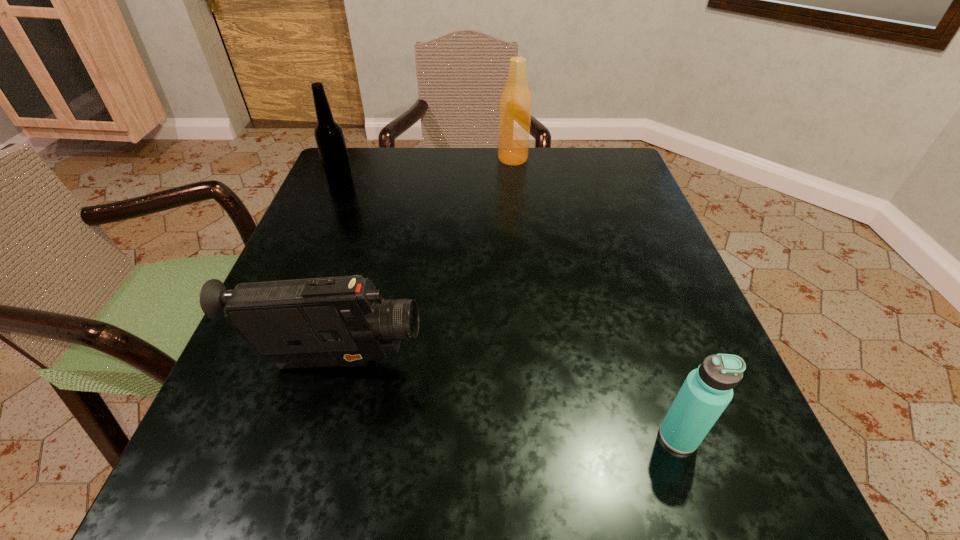
Identify the location of free space that satisfies the following two spatial constraints: 1. on the back side of the nearest object; 2. on the front-facing side of the camcorder. The height and width of the screenshot is (540, 960). (654, 363).

Locate an element on the screen. The height and width of the screenshot is (540, 960). free region that satisfies the following two spatial constraints: 1. on the front-facing side of the rightmost object; 2. on the right side of the camcorder is located at coordinates (314, 436).